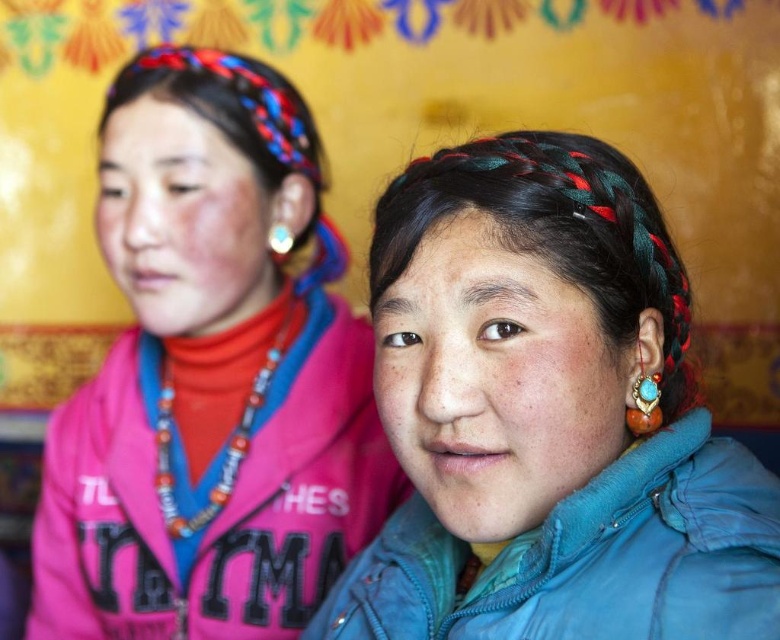
You are an artist trying to sketch the scene. You need to decide which object to draw first based on their sizes. Which one should you start with, the matte pink jacket at left or the turquoise stone ring at ear?

The matte pink jacket at left is wider than the turquoise stone ring at ear, so you should start drawing the matte pink jacket at left first because it is larger in size.

You are standing in front of the two individuals in the image. You want to place a small decoration at point (211, 376). Which person should you approach to place the decoration on their clothing?

The point (211, 376) is on the matte pink jacket at left, so you should approach the person on the left to place the decoration there.